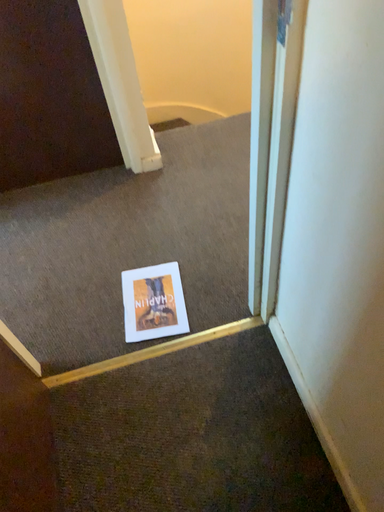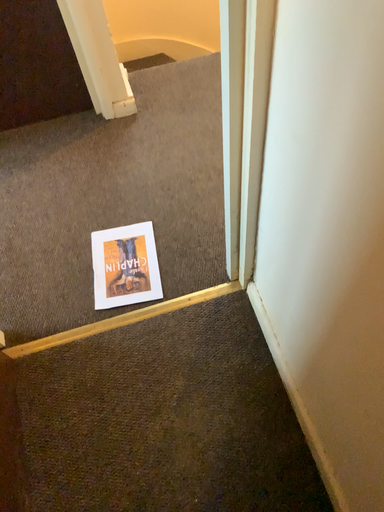
Question: How did the camera likely rotate when shooting the video?

Choices:
 (A) rotated upward
 (B) rotated downward

Answer: (B)